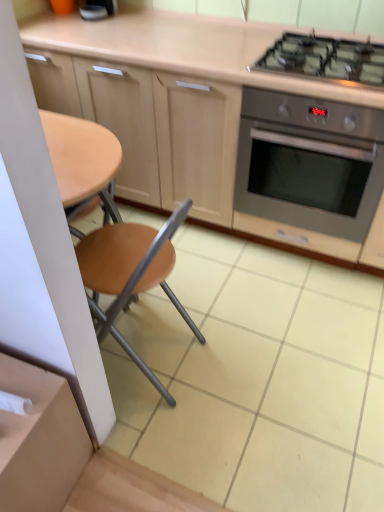
Question: Visually, is stainless steel oven at right positioned to the left or to the right of black glass gas stove at upper right?

Choices:
 (A) right
 (B) left

Answer: (A)

Question: From a real-world perspective, is stainless steel oven at right above or below black glass gas stove at upper right?

Choices:
 (A) above
 (B) below

Answer: (B)

Question: Which object is positioned closest to the wooden seat at center?

Choices:
 (A) matte wood cabinetry at upper center
 (B) stainless steel oven at right
 (C) black glass gas stove at upper right

Answer: (B)

Question: Which of these objects is positioned farthest from the black glass gas stove at upper right?

Choices:
 (A) matte wood cabinetry at upper center
 (B) wooden seat at center
 (C) stainless steel oven at right

Answer: (B)